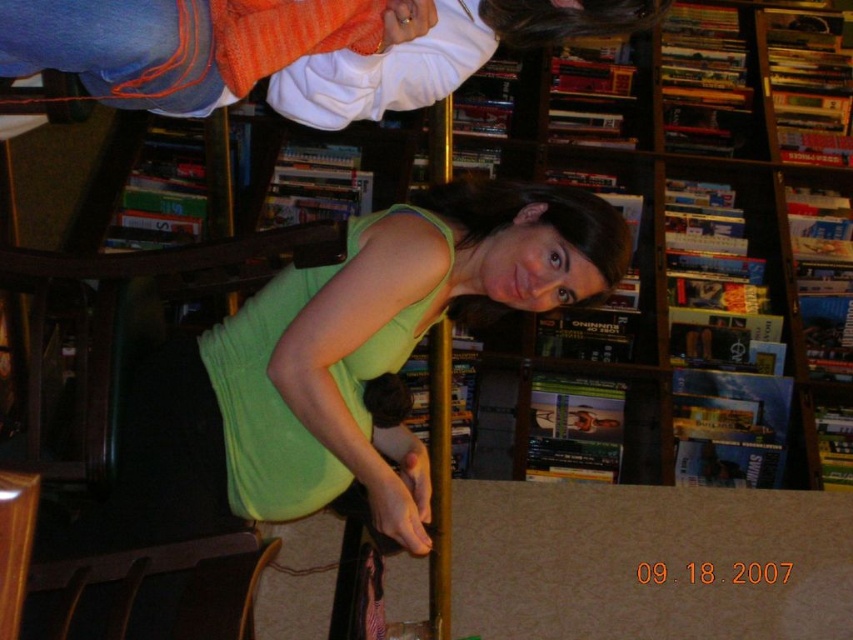
You are a store manager checking the layout of your bookstore. You notice the wooden bookshelf at center and the green matte tank top at center. Which object is wider in the image?

The wooden bookshelf at center is wider than the green matte tank top at center according to the description.

You are a delivery person who needs to place a package that is 1.5 meters long between the wooden bookshelf at center and the green matte tank top at center. Can you fit the package between them without moving either object?

The wooden bookshelf at center and green matte tank top at center are 1.64 meters apart from each other. Since the package is 1.5 meters long, which is shorter than the distance between them, the package can be placed between them without moving either object.

You are standing in a bookstore and want to reach the wooden bookshelf at center to pick a book. However, there is a person in front of you wearing a green matte tank top at center. Can you walk around them to access the bookshelf?

The wooden bookshelf at center is further to the viewer than green matte tank top at center, so the person is closer to you. You can walk around them to reach the wooden bookshelf at center.